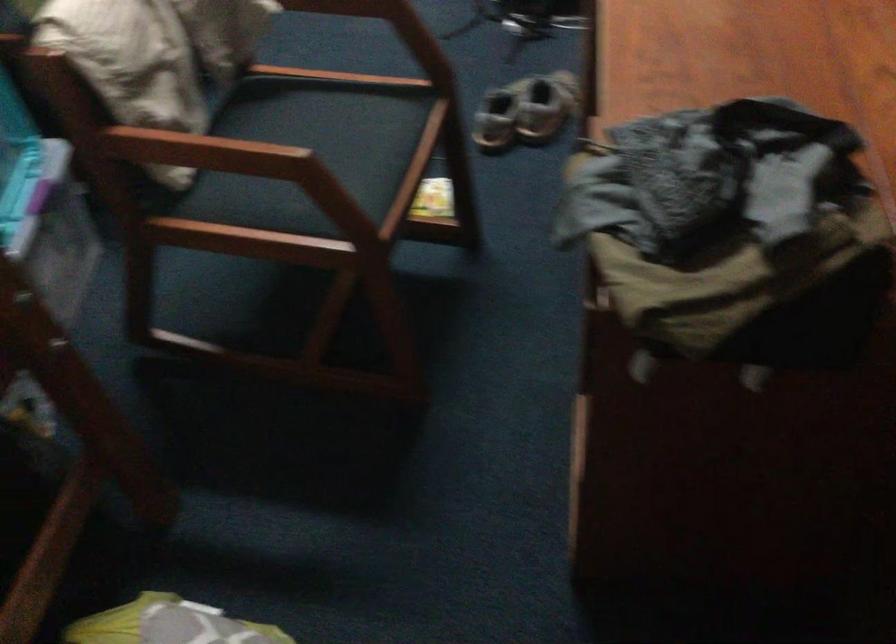
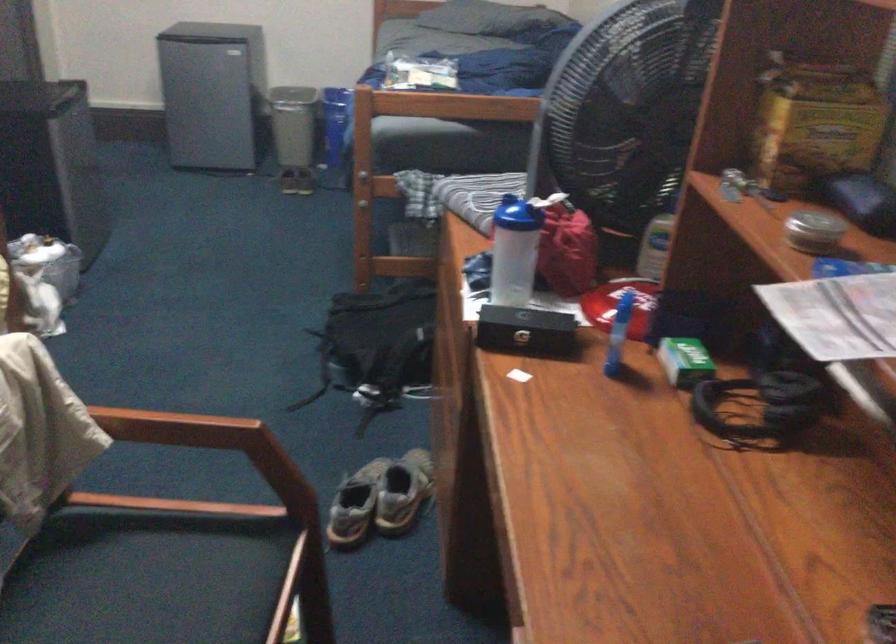
Find the pixel in the second image that matches (500,118) in the first image.

(355, 505)